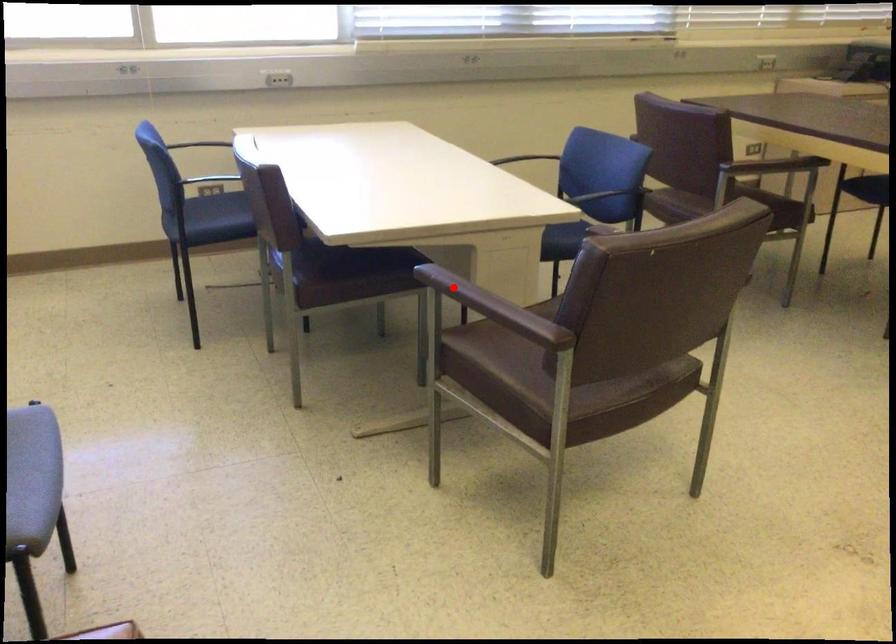
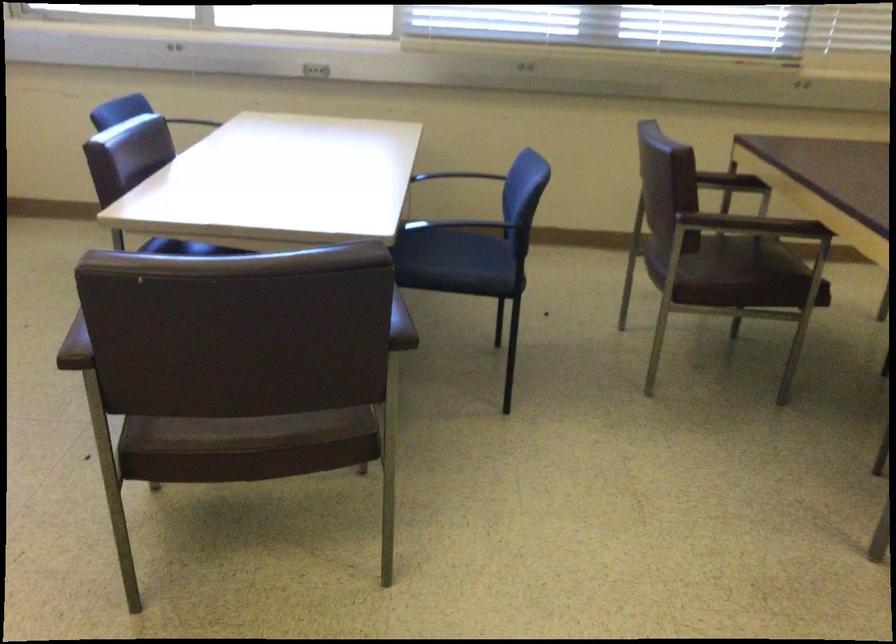
Question: I am providing you with two images of the same scene from different viewpoints. A red point is marked on the first image. At the location where the point appears in image 1, is it still visible in image 2?

Choices:
 (A) Yes
 (B) No

Answer: (B)